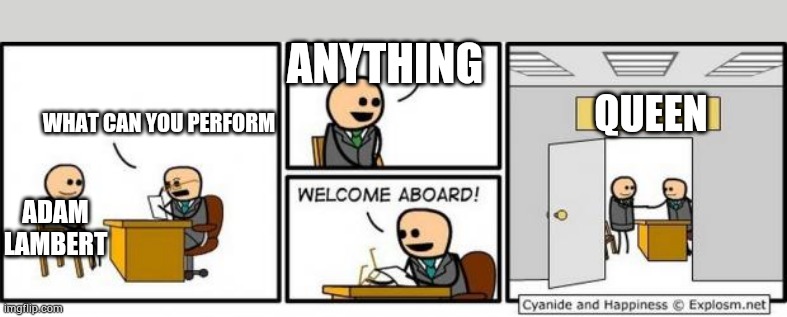
This screenshot has width=787, height=317. In order to click on door in this screenshot , I will do `click(574, 235)`.